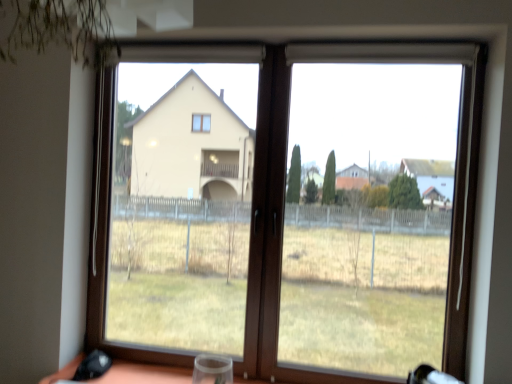
Question: From the image's perspective, relative to brown wooden window at center, is transparent plastic wine glass at bottom center above or below?

Choices:
 (A) below
 (B) above

Answer: (A)

Question: Is transparent plastic wine glass at bottom center spatially inside brown wooden window at center, or outside of it?

Choices:
 (A) inside
 (B) outside

Answer: (B)

Question: Is point (198, 375) closer or farther from the camera than point (267, 279)?

Choices:
 (A) closer
 (B) farther

Answer: (B)

Question: From a real-world perspective, is brown wooden window at center above or below transparent plastic wine glass at bottom center?

Choices:
 (A) above
 (B) below

Answer: (A)

Question: Is brown wooden window at center to the left or to the right of transparent plastic wine glass at bottom center in the image?

Choices:
 (A) right
 (B) left

Answer: (A)

Question: From the image's perspective, is brown wooden window at center positioned above or below transparent plastic wine glass at bottom center?

Choices:
 (A) above
 (B) below

Answer: (A)

Question: In terms of height, does brown wooden window at center look taller or shorter compared to transparent plastic wine glass at bottom center?

Choices:
 (A) short
 (B) tall

Answer: (B)